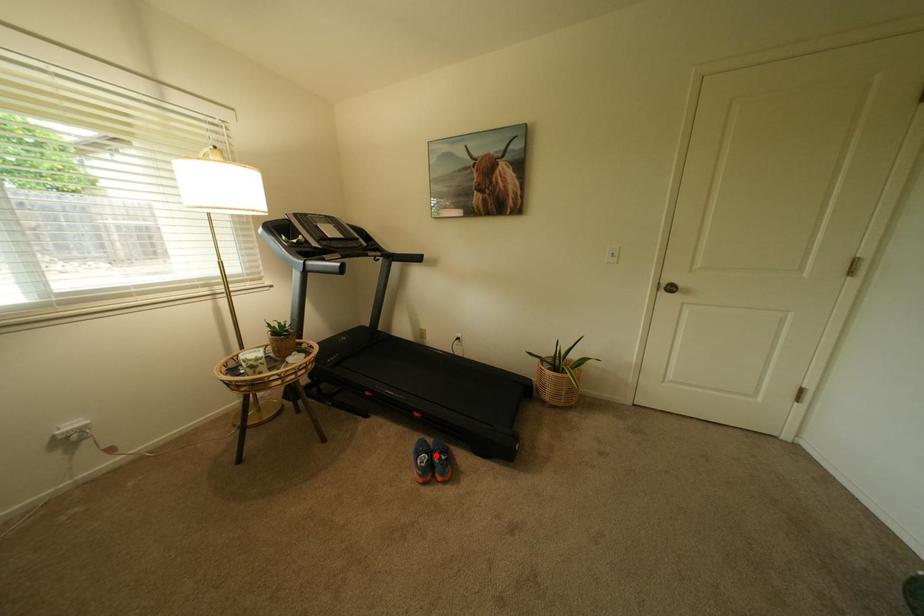
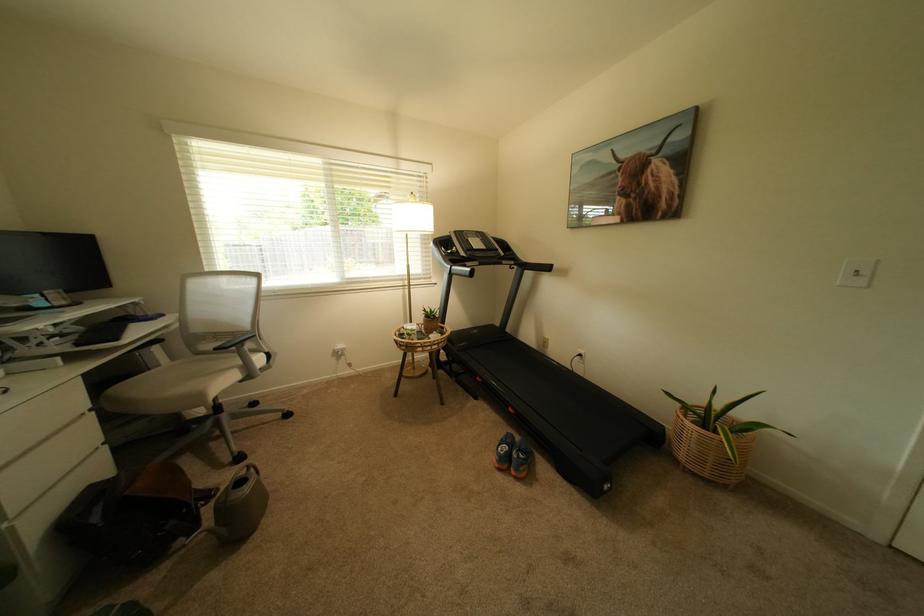
Where in the second image is the point corresponding to the highlighted location from the first image?

(517, 448)